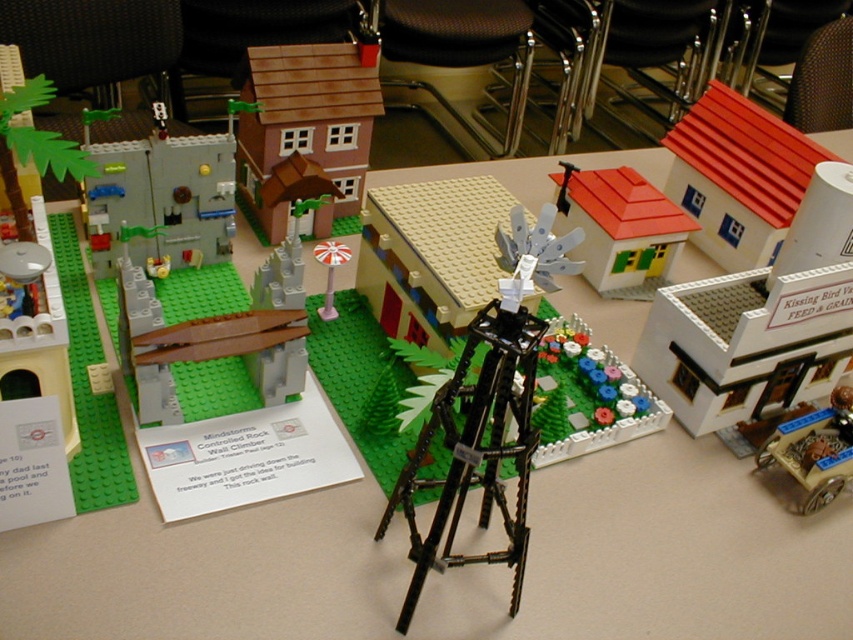
Question: Which object is farther from the camera taking this photo?

Choices:
 (A) smooth plastic house at upper right
 (B) white plastic bird at center
 (C) smooth gray wall at left

Answer: (A)

Question: In this image, where is white matte building at center-right located relative to smooth plastic house at upper right?

Choices:
 (A) left
 (B) right

Answer: (A)

Question: Which point is closer to the camera?

Choices:
 (A) (706, 221)
 (B) (636, 289)
 (C) (331, 316)

Answer: (C)

Question: Is brown matte house at upper center behind white plastic windmill at center?

Choices:
 (A) no
 (B) yes

Answer: (B)

Question: Which point is closer to the camera?

Choices:
 (A) brown matte house at upper center
 (B) wooden cart at lower right
 (C) smooth gray wall at left
 (D) white plastic bird at center

Answer: (B)

Question: Is the position of brown matte house at upper center more distant than that of smooth gray wall at left?

Choices:
 (A) no
 (B) yes

Answer: (B)